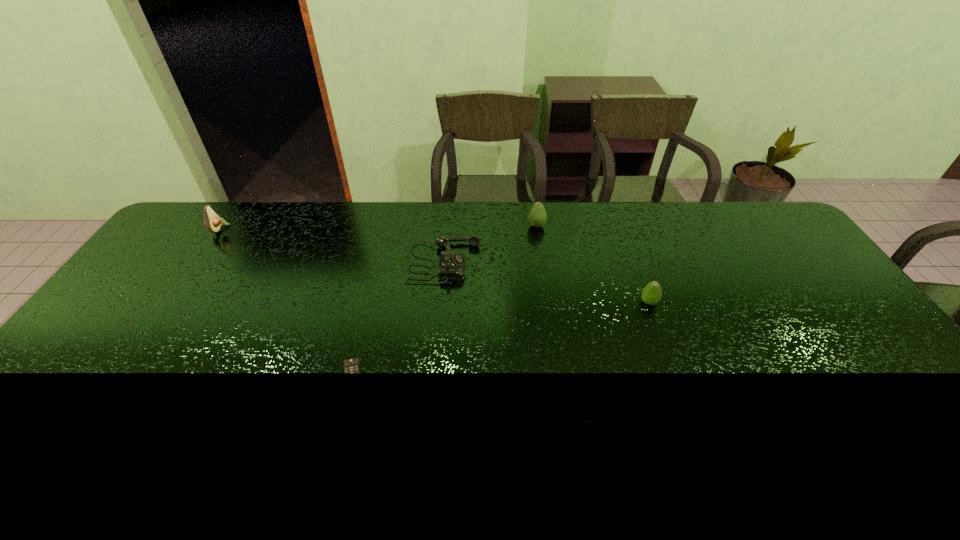
The width and height of the screenshot is (960, 540). Find the location of `the leftmost avocado`. the leftmost avocado is located at coordinates (212, 222).

Locate an element on the screen. The height and width of the screenshot is (540, 960). the leftmost object is located at coordinates (212, 222).

In order to click on the second object from right to left in this screenshot , I will do click(x=537, y=216).

What are the coordinates of `the third object from left to right` in the screenshot? It's located at (451, 265).

Find the location of a particular element. The width and height of the screenshot is (960, 540). the third farthest object is located at coordinates (451, 265).

The width and height of the screenshot is (960, 540). I want to click on the second nearest object, so click(x=652, y=292).

Locate an element on the screen. This screenshot has height=540, width=960. the nearest avocado is located at coordinates (652, 292).

What are the coordinates of `the shortest object` in the screenshot? It's located at (350, 365).

You are a GUI agent. You are given a task and a screenshot of the screen. Output one action in this format:
    pyautogui.click(x=<x>, y=<y>)
    Task: Click on the nearest object
    This screenshot has height=540, width=960.
    Given the screenshot: What is the action you would take?
    pyautogui.click(x=350, y=365)

Image resolution: width=960 pixels, height=540 pixels. In order to click on free spot located 0.390m on the seed side of the tallest object in this screenshot , I will do `click(338, 228)`.